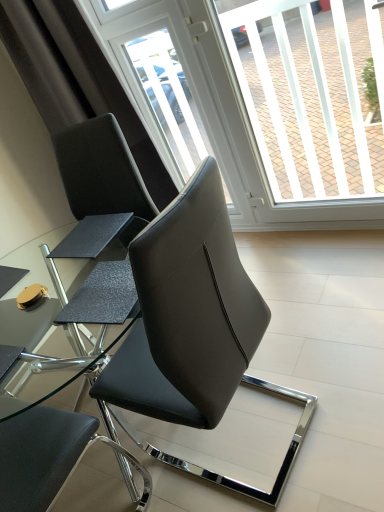
Locate an element on the screen. Image resolution: width=384 pixels, height=512 pixels. free space between black leather chair at center, which is the third chair in back-to-front order, and transparent glass window screen at upper center is located at coordinates (317, 298).